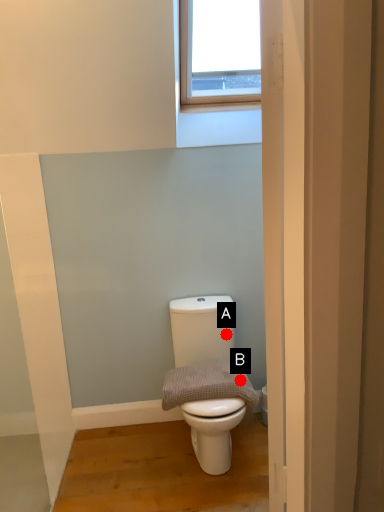
Question: Two points are circled on the image, labeled by A and B beside each circle. Among these points, which one is nearest to the camera?

Choices:
 (A) A is closer
 (B) B is closer

Answer: (B)